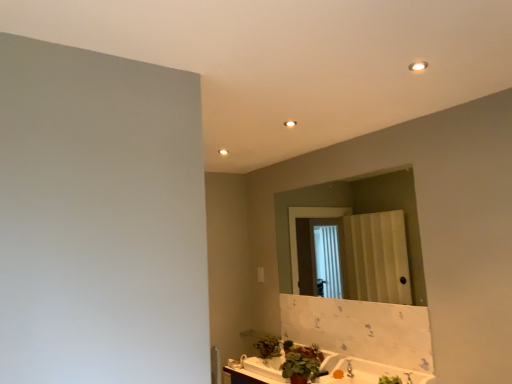
The width and height of the screenshot is (512, 384). What do you see at coordinates (368, 371) in the screenshot?
I see `white glossy countertop at lower center` at bounding box center [368, 371].

Describe the element at coordinates (356, 213) in the screenshot. The image size is (512, 384). I see `matte glass mirror at center` at that location.

What are the coordinates of `white glossy light fixture at upper right` in the screenshot? It's located at (418, 66).

At what (x,y) coordinates should I click in order to perform the action: click on white glossy countertop at lower center. Please return your answer as a coordinate pair (x, y). This screenshot has height=384, width=512. Looking at the image, I should click on (368, 371).

How many degrees apart are the facing directions of matte glass mirror at center and green leafy plant at lower center, the 3th plant viewed from the front?

2 degrees separate the facing orientations of matte glass mirror at center and green leafy plant at lower center, the 3th plant viewed from the front.

Does matte glass mirror at center have a lesser height compared to green leafy plant at lower center, the 3th plant viewed from the front?

In fact, matte glass mirror at center may be taller than green leafy plant at lower center, the 3th plant viewed from the front.

Would you say matte glass mirror at center is inside or outside green leafy plant at lower center, the 3th plant viewed from the front?

matte glass mirror at center exists outside the volume of green leafy plant at lower center, the 3th plant viewed from the front.

Is matte glass mirror at center positioned with its back to green leafy plant at lower center, marked as the 1th plant in a back-to-front arrangement?

No, matte glass mirror at center's orientation is not away from green leafy plant at lower center, marked as the 1th plant in a back-to-front arrangement.

Can you tell me how much green matte plant at lower center, the 2th plant in the front-to-back sequence, and matte glass mirror at center differ in facing direction?

The facing directions of green matte plant at lower center, the 2th plant in the front-to-back sequence, and matte glass mirror at center are 2 degrees apart.

Based on the photo, from the image's perspective, between green matte plant at lower center, acting as the second plant starting from the back, and matte glass mirror at center, which one is located above?

matte glass mirror at center, from the image's perspective.

Does green matte plant at lower center, the 2th plant in the front-to-back sequence, lie behind matte glass mirror at center?

Yes, green matte plant at lower center, the 2th plant in the front-to-back sequence, is further from the camera.

Does point (277, 338) come closer to viewer compared to point (405, 176)?

No, (277, 338) is behind (405, 176).

Is matte glass mirror at center spatially inside green matte plant at lower center, the 1th plant positioned from the front, or outside of it?

matte glass mirror at center lies outside green matte plant at lower center, the 1th plant positioned from the front.

Locate an element on the screen. mirror on the right of green matte plant at lower center, the 1th plant positioned from the front is located at coordinates (356, 213).

Is matte glass mirror at center bigger than green matte plant at lower center, the 1th plant positioned from the front?

Yes, matte glass mirror at center is bigger than green matte plant at lower center, the 1th plant positioned from the front.

Which is closer, [277,241] or [307,374]?

Clearly, point [277,241] is more distant from the camera than point [307,374].

Is silver metallic faucet at lower center wider than white glossy light fixture at upper right?

Correct, the width of silver metallic faucet at lower center exceeds that of white glossy light fixture at upper right.

In the scene shown: Is silver metallic faucet at lower center positioned with its back to white glossy light fixture at upper right?

No.

Is silver metallic faucet at lower center completely or partially outside of white glossy light fixture at upper right?

silver metallic faucet at lower center is positioned outside white glossy light fixture at upper right.

You are a GUI agent. You are given a task and a screenshot of the screen. Output one action in this format:
    pyautogui.click(x=<x>, y=<y>)
    Task: Click on the 3rd plant behind the white glossy countertop at lower center, counting from the anchor's position
    This screenshot has width=512, height=384.
    Given the screenshot: What is the action you would take?
    pyautogui.click(x=288, y=346)

Does green leafy plant at lower center, the 3th plant viewed from the front, have a lesser height compared to white glossy countertop at lower center?

Correct, green leafy plant at lower center, the 3th plant viewed from the front, is not as tall as white glossy countertop at lower center.

Is point (288, 348) positioned in front of point (386, 365)?

No, it is not.

From a real-world perspective, does green leafy plant at lower center, the 3th plant viewed from the front, stand above white glossy countertop at lower center?

Yes, from a real-world perspective, green leafy plant at lower center, the 3th plant viewed from the front, is over white glossy countertop at lower center

Does green matte plant at lower center, the 2th plant in the front-to-back sequence, appear on the left side of green leafy plant at lower center, the 3th plant viewed from the front?

Result: Indeed, green matte plant at lower center, the 2th plant in the front-to-back sequence, is positioned on the left side of green leafy plant at lower center, the 3th plant viewed from the front.

From the picture: Would you consider green matte plant at lower center, acting as the second plant starting from the back, to be distant from green leafy plant at lower center, marked as the 1th plant in a back-to-front arrangement?

That's not correct — green matte plant at lower center, acting as the second plant starting from the back, is a little close to green leafy plant at lower center, marked as the 1th plant in a back-to-front arrangement.

Considering the sizes of green matte plant at lower center, acting as the second plant starting from the back, and green leafy plant at lower center, marked as the 1th plant in a back-to-front arrangement, in the image, is green matte plant at lower center, acting as the second plant starting from the back, taller or shorter than green leafy plant at lower center, marked as the 1th plant in a back-to-front arrangement,?

Clearly, green matte plant at lower center, acting as the second plant starting from the back, is taller compared to green leafy plant at lower center, marked as the 1th plant in a back-to-front arrangement.

From the image's perspective, relative to green leafy plant at lower center, the 3th plant viewed from the front, is green matte plant at lower center, acting as the second plant starting from the back, above or below?

From the image's perspective, green matte plant at lower center, acting as the second plant starting from the back, appears above green leafy plant at lower center, the 3th plant viewed from the front.

Considering the relative sizes of silver metallic faucet at lower center and green matte plant at lower center, the 1th plant positioned from the front, in the image provided, is silver metallic faucet at lower center smaller than green matte plant at lower center, the 1th plant positioned from the front,?

Yes, silver metallic faucet at lower center is smaller than green matte plant at lower center, the 1th plant positioned from the front.

From the image's perspective, between silver metallic faucet at lower center and green matte plant at lower center, the 1th plant positioned from the front, who is located below?

silver metallic faucet at lower center appears lower in the image.

Considering the relative positions of silver metallic faucet at lower center and green matte plant at lower center, the third plant positioned from the back, in the image provided, is silver metallic faucet at lower center to the left or to the right of green matte plant at lower center, the third plant positioned from the back,?

silver metallic faucet at lower center is positioned on green matte plant at lower center, the third plant positioned from the back,'s right side.

From the image's perspective, starting from the matte glass mirror at center, which plant is the 3rd one below? Please provide its 2D coordinates.

[(288, 346)]

Find the location of a particular element. This screenshot has height=384, width=512. mirror above the green matte plant at lower center, the 2th plant in the front-to-back sequence (from a real-world perspective) is located at coordinates pyautogui.click(x=356, y=213).

Based on their spatial positions, is silver metallic faucet at lower center or white glossy light fixture at upper right further from green leafy plant at lower center, marked as the 1th plant in a back-to-front arrangement?

white glossy light fixture at upper right is positioned further to the anchor green leafy plant at lower center, marked as the 1th plant in a back-to-front arrangement.

Considering their positions, is green leafy plant at lower center, marked as the 1th plant in a back-to-front arrangement, positioned further to white glossy countertop at lower center than matte glass mirror at center?

Based on the image, matte glass mirror at center appears to be further to white glossy countertop at lower center.

When comparing their distances from white glossy light fixture at upper right, does silver metallic faucet at lower center or green leafy plant at lower center, marked as the 1th plant in a back-to-front arrangement, seem further?

green leafy plant at lower center, marked as the 1th plant in a back-to-front arrangement.

Which object lies nearer to the anchor point green leafy plant at lower center, the 3th plant viewed from the front, green matte plant at lower center, the 2th plant in the front-to-back sequence, or matte glass mirror at center?

green matte plant at lower center, the 2th plant in the front-to-back sequence, is positioned closer to the anchor green leafy plant at lower center, the 3th plant viewed from the front.

Looking at the image, which one is located closer to green matte plant at lower center, the 1th plant positioned from the front, white glossy countertop at lower center or white glossy light fixture at upper right?

Result: Based on the image, white glossy countertop at lower center appears to be nearer to green matte plant at lower center, the 1th plant positioned from the front.

Looking at the image, which one is located further to white glossy countertop at lower center, green matte plant at lower center, acting as the second plant starting from the back, or white glossy light fixture at upper right?

white glossy light fixture at upper right.

From the image, which object appears to be farther from green matte plant at lower center, the 1th plant positioned from the front, white glossy countertop at lower center or green matte plant at lower center, acting as the second plant starting from the back?

green matte plant at lower center, acting as the second plant starting from the back.

Considering their positions, is green matte plant at lower center, the 1th plant positioned from the front, positioned further to white glossy countertop at lower center than matte glass mirror at center?

matte glass mirror at center.

Find the location of a particular element. plant between matte glass mirror at center and silver metallic faucet at lower center from top to bottom is located at coordinates (298, 365).

Image resolution: width=512 pixels, height=384 pixels. I want to click on counter top situated between green matte plant at lower center, the third plant positioned from the back, and silver metallic faucet at lower center from left to right, so click(368, 371).

You are a GUI agent. You are given a task and a screenshot of the screen. Output one action in this format:
    pyautogui.click(x=<x>, y=<y>)
    Task: Click on the plant located between green matte plant at lower center, the 1th plant positioned from the front, and green leafy plant at lower center, marked as the 1th plant in a back-to-front arrangement, in the depth direction
    
    Given the screenshot: What is the action you would take?
    pyautogui.click(x=268, y=347)

Where is `mirror between white glossy light fixture at upper right and green leafy plant at lower center, the 3th plant viewed from the front, in the vertical direction`? mirror between white glossy light fixture at upper right and green leafy plant at lower center, the 3th plant viewed from the front, in the vertical direction is located at coordinates (356, 213).